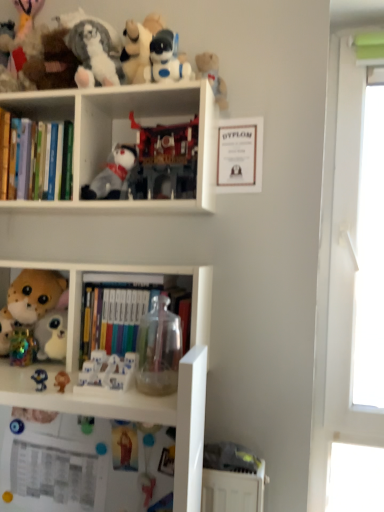
Question: Considering the positions of white plastic figurines at center, which appears as the fourth toy when ordered from the bottom, and white plastic bookshelf at upper center in the image, is white plastic figurines at center, which appears as the fourth toy when ordered from the bottom, taller or shorter than white plastic bookshelf at upper center?

Choices:
 (A) short
 (B) tall

Answer: (A)

Question: Is point (127, 352) closer or farther from the camera than point (152, 99)?

Choices:
 (A) farther
 (B) closer

Answer: (B)

Question: Which object is the closest to the white plush toy at center, the eighth toy in the bottom-to-top sequence?

Choices:
 (A) hardcover books at left, which is counted as the first book, starting from the left
 (B) fluffy plush penguin at upper left, the eleventh toy when ordered from bottom to top
 (C) matte blue plush at lower left, which is the third toy in bottom-to-top order
 (D) white plastic bookshelf at upper center
 (E) plastic matte robot at center, the third toy when ordered from top to bottom

Answer: (E)

Question: Which object is the closest to the hardcover books at center, which appears as the 1th book when ordered from the bottom?

Choices:
 (A) matte plastic toy at lower center, the first toy positioned from the bottom
 (B) transparent plastic window at right
 (C) white plush toy at center, the eighth toy in the bottom-to-top sequence
 (D) fluffy plush toy at left, the seventh toy from the bottom
 (E) white plastic shelf at lower left

Answer: (E)